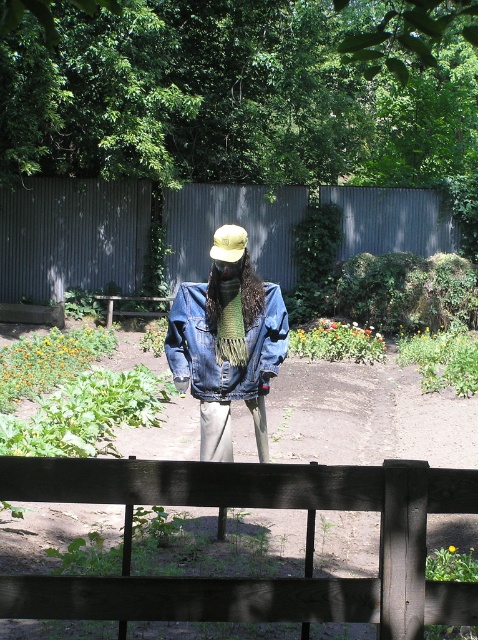
Question: Which point is farther to the camera?

Choices:
 (A) metallic gray fence at center
 (B) matte yellow hat at center
 (C) wooden park bench at center
 (D) denim jacket at center

Answer: (A)

Question: Can you confirm if black wood fence at center is bigger than metallic gray fence at center?

Choices:
 (A) no
 (B) yes

Answer: (A)

Question: Which of the following is the closest to the observer?

Choices:
 (A) wooden park bench at center
 (B) denim jacket at center
 (C) metallic gray fence at center

Answer: (B)

Question: Can you confirm if matte yellow hat at center is wider than wooden park bench at center?

Choices:
 (A) no
 (B) yes

Answer: (A)

Question: Can you confirm if metallic gray fence at center is wider than matte yellow hat at center?

Choices:
 (A) yes
 (B) no

Answer: (A)

Question: Which of the following is the closest to the observer?

Choices:
 (A) (411, 582)
 (B) (246, 243)
 (C) (0, 291)
 (D) (117, 312)

Answer: (A)